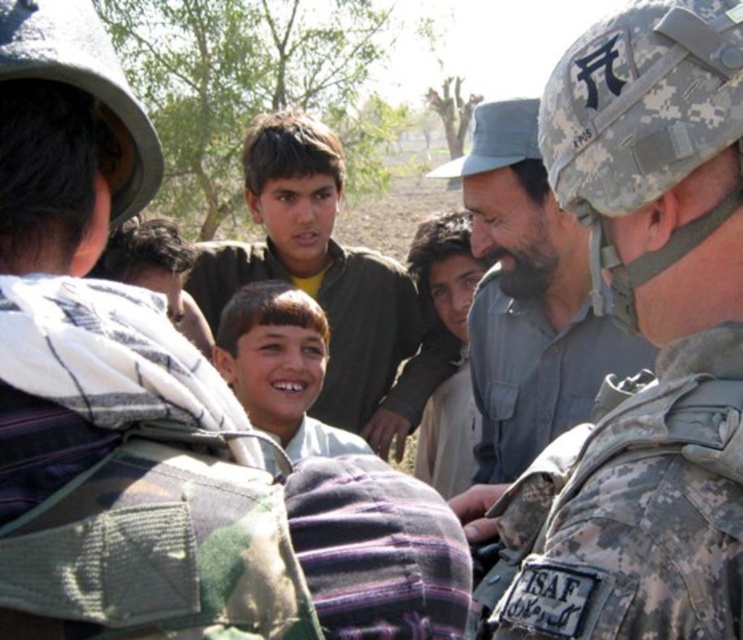
Who is lower down, gray matte shirt at center or smooth brown face at center?

smooth brown face at center

Can you confirm if gray matte shirt at center is shorter than smooth brown face at center?

No.

Which is in front, point (574, 305) or point (236, 312)?

Point (574, 305) is in front.

This screenshot has width=743, height=640. Identify the location of gray matte shirt at center. (528, 305).

Does camouflage uniform at center come in front of smooth brown face at center?

Yes, it is in front of smooth brown face at center.

The width and height of the screenshot is (743, 640). Describe the element at coordinates (646, 339) in the screenshot. I see `camouflage uniform at center` at that location.

Locate an element on the screen. The image size is (743, 640). camouflage uniform at center is located at coordinates click(x=646, y=339).

Between camouflage uniform at center and gray matte shirt at center, which one appears on the left side from the viewer's perspective?

Positioned to the left is camouflage uniform at center.

Is camouflage uniform at center to the right of gray matte shirt at center from the viewer's perspective?

No, camouflage uniform at center is not to the right of gray matte shirt at center.

Who is more distant from viewer, [661,232] or [484,412]?

Point [484,412]

You are a GUI agent. You are given a task and a screenshot of the screen. Output one action in this format:
    pyautogui.click(x=<x>, y=<y>)
    Task: Click on the camouflage uniform at center
    
    Given the screenshot: What is the action you would take?
    pyautogui.click(x=646, y=339)